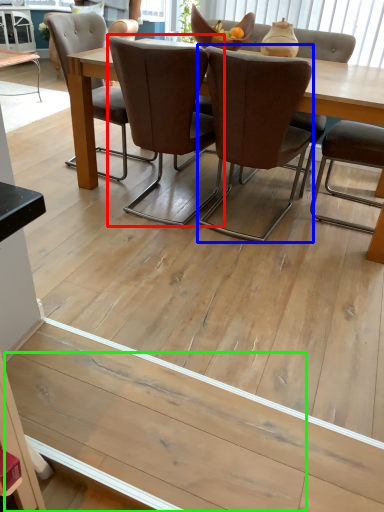
Question: Estimate the real-world distances between objects in this image. Which object is closer to chair (highlighted by a red box), chair (highlighted by a blue box) or plank (highlighted by a green box)?

Choices:
 (A) chair
 (B) plank

Answer: (A)